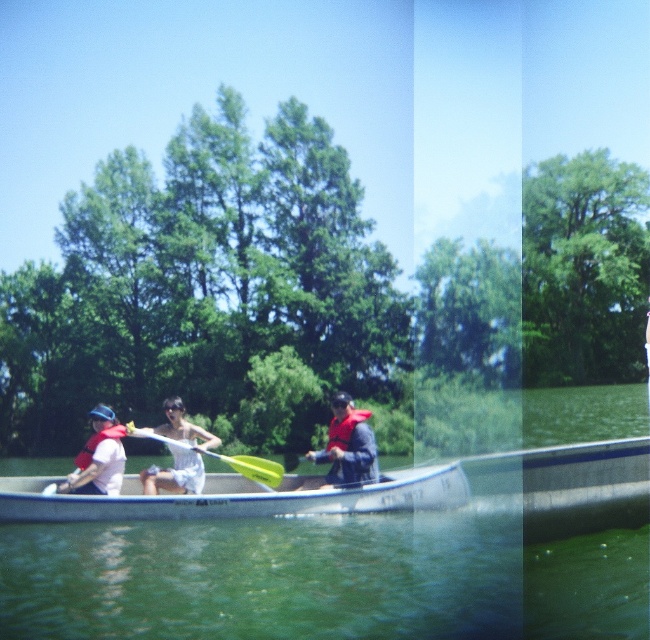
Question: Based on their relative distances, which object is nearer to the green liquid water at center?

Choices:
 (A) yellow plastic paddle at center
 (B) white cotton shirt at center
 (C) matte red life vest at left
 (D) red matte life jacket at center

Answer: (A)

Question: Can you confirm if matte red life vest at left is wider than red matte life jacket at center?

Choices:
 (A) no
 (B) yes

Answer: (B)

Question: Which object is farther from the camera taking this photo?

Choices:
 (A) white cotton shirt at center
 (B) yellow plastic paddle at center
 (C) white matte canoe at center

Answer: (B)

Question: Estimate the real-world distances between objects in this image. Which object is closer to the white matte canoe at center?

Choices:
 (A) red matte life jacket at center
 (B) yellow plastic paddle at center
 (C) white cotton shirt at center
 (D) red life vest at center

Answer: (C)

Question: In this image, where is matte red life vest at left located relative to yellow plastic paddle at center?

Choices:
 (A) above
 (B) below

Answer: (A)

Question: Is white matte canoe at center further to camera compared to yellow plastic paddle at center?

Choices:
 (A) no
 (B) yes

Answer: (A)